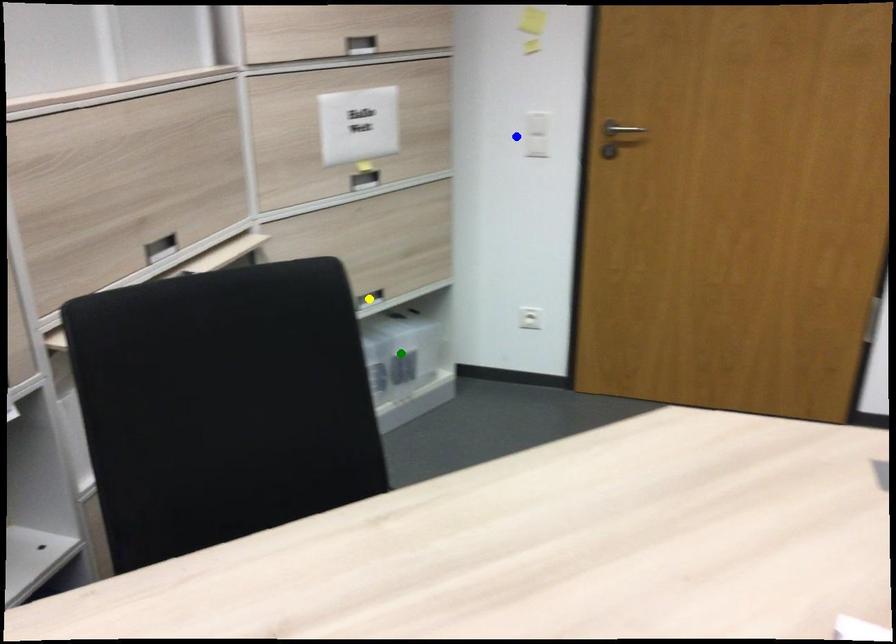
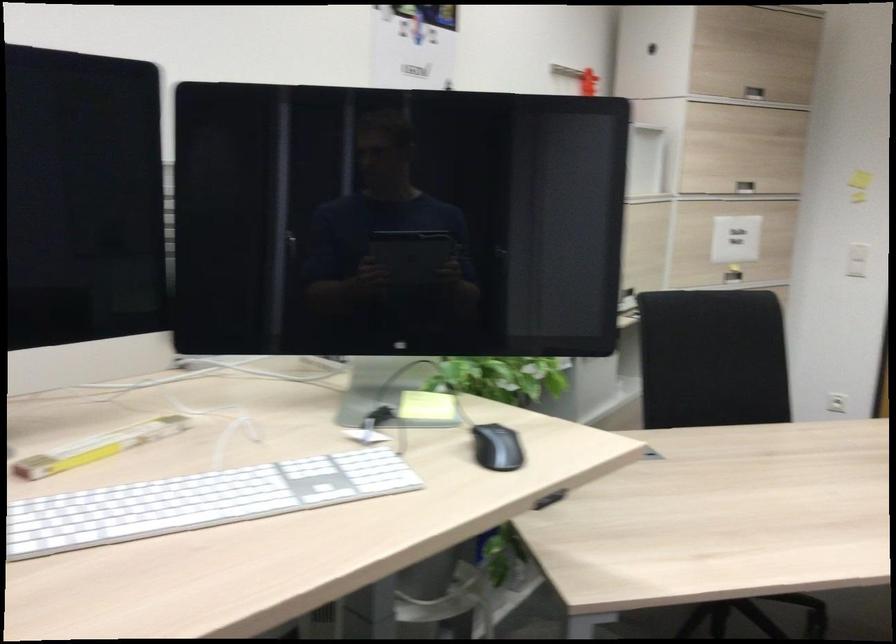
I am providing you with two images of the same scene from different viewpoints. Three points are marked in image1. Which point corresponds to a part or object that is occluded in image2?In image1, three points are marked. Which of them correspond to a part or object that is occluded in image2?Among the three points shown in image1, which one corresponds to a part or object that is no longer visible due to occlusion in image2?

yellow point, green point